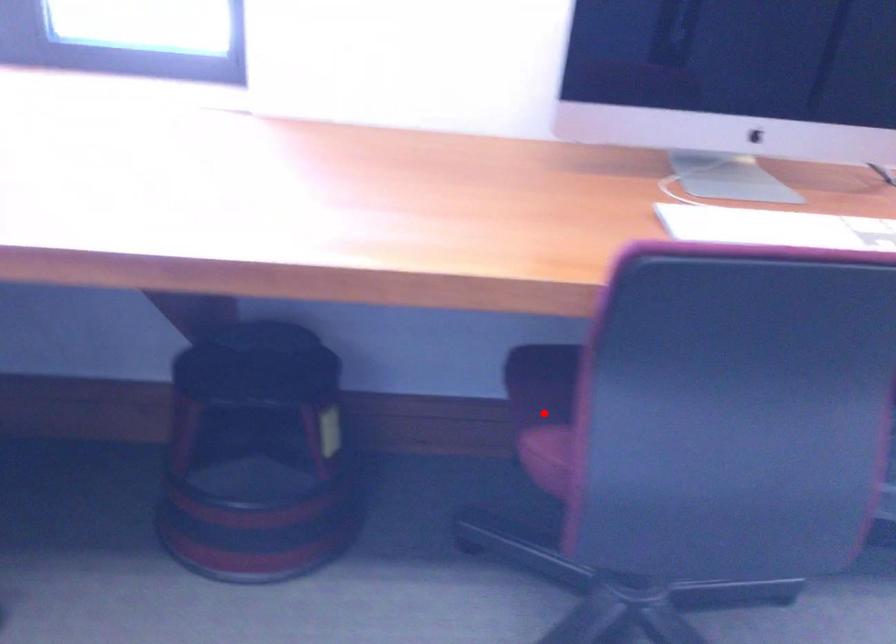
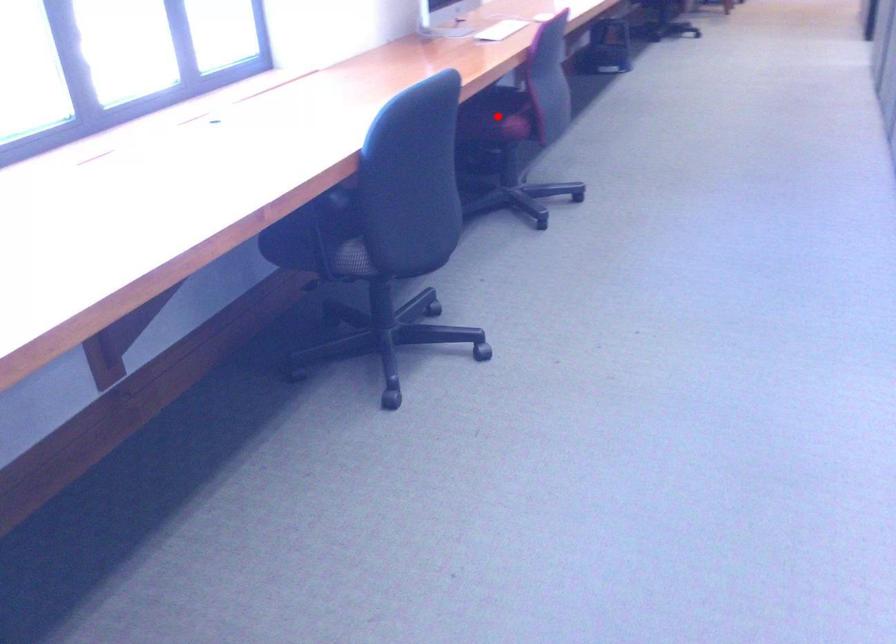
I am providing you with two images of the same scene from different viewpoints. A red point is marked on the first image and another point is marked on the second image. Does the point marked in image1 correspond to the same location as the one in image2?

Yes